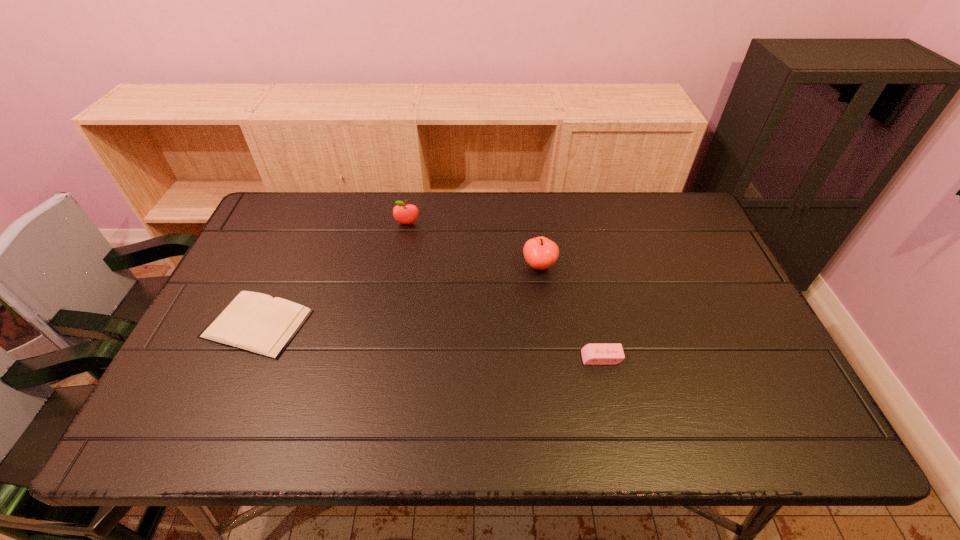
You are a GUI agent. You are given a task and a screenshot of the screen. Output one action in this format:
    pyautogui.click(x=<x>, y=<y>)
    Task: Click on the second object from right to left
    This screenshot has width=960, height=540.
    Given the screenshot: What is the action you would take?
    pyautogui.click(x=540, y=253)

This screenshot has width=960, height=540. Find the location of `the second farthest object`. the second farthest object is located at coordinates (540, 253).

This screenshot has width=960, height=540. Identify the location of the left apple. (403, 213).

Where is `the farthest object`? The height and width of the screenshot is (540, 960). the farthest object is located at coordinates (403, 213).

The image size is (960, 540). What are the coordinates of `the rightmost object` in the screenshot? It's located at (x=592, y=354).

At what (x,y) coordinates should I click in order to perform the action: click on the third tallest object. Please return your answer as a coordinate pair (x, y). The width and height of the screenshot is (960, 540). Looking at the image, I should click on (592, 354).

Where is `hardback book`? hardback book is located at coordinates (255, 322).

At what (x,y) coordinates should I click in order to perform the action: click on the leftmost object. Please return your answer as a coordinate pair (x, y). The image size is (960, 540). Looking at the image, I should click on (255, 322).

I want to click on vacant space located on the back of the nearer apple, so click(x=533, y=221).

This screenshot has height=540, width=960. I want to click on free location located on the front of the farther apple, so click(401, 260).